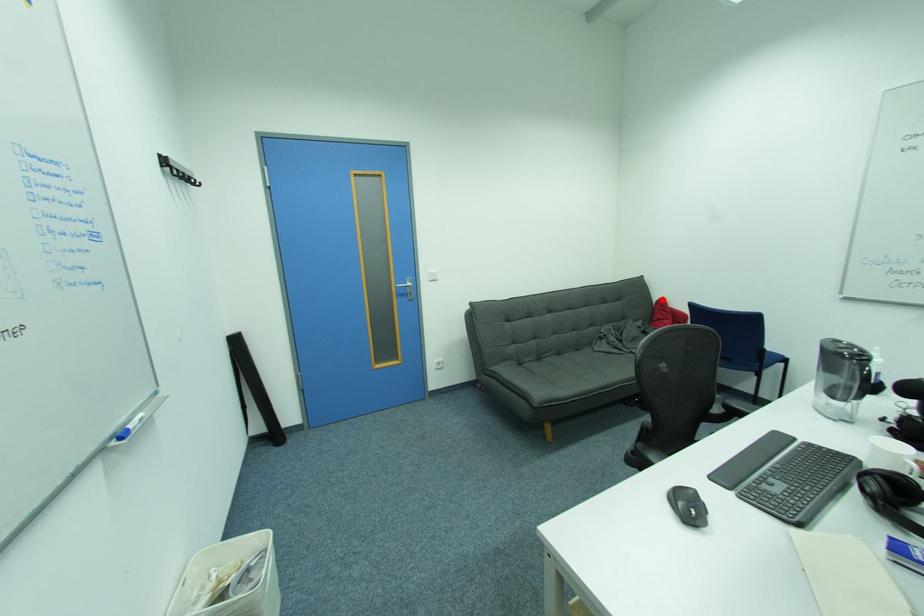
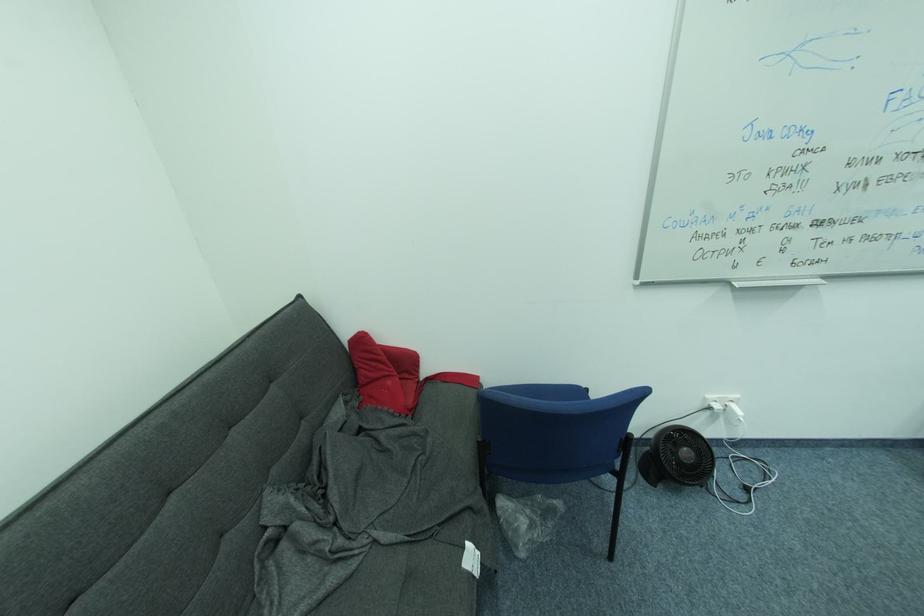
Find the pixel in the second image that matches the highlighted location in the first image.

(353, 336)